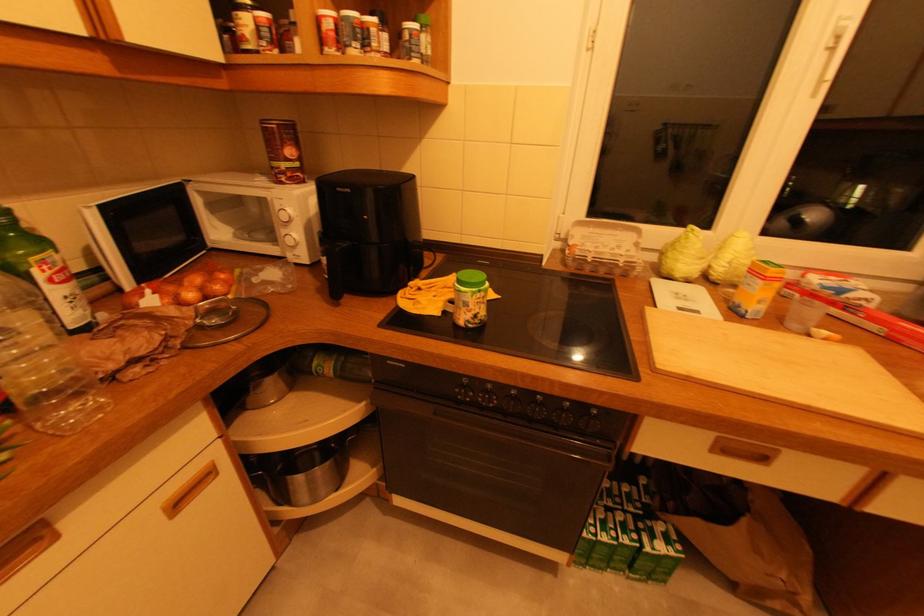
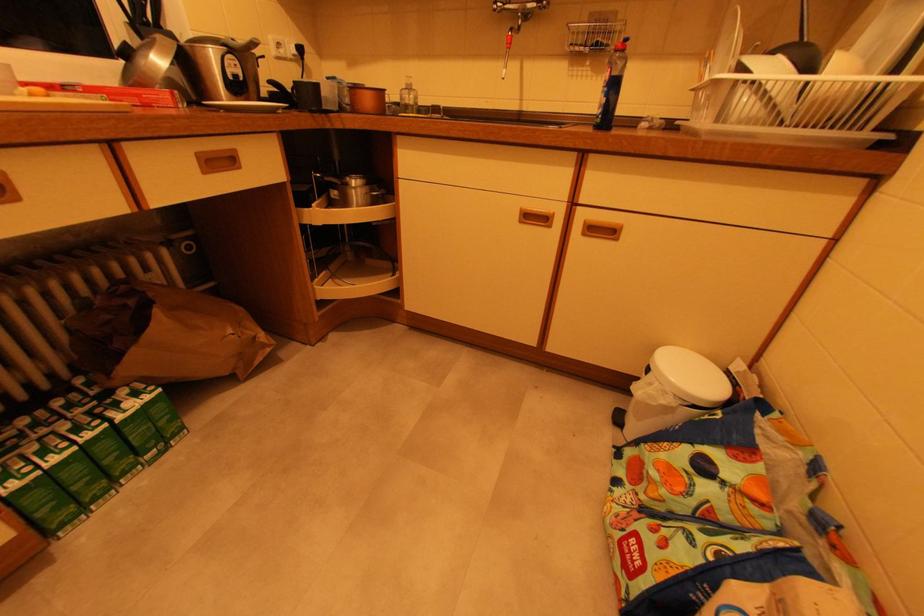
Locate, in the second image, the point that corresponds to (x=637, y=488) in the first image.

(78, 395)